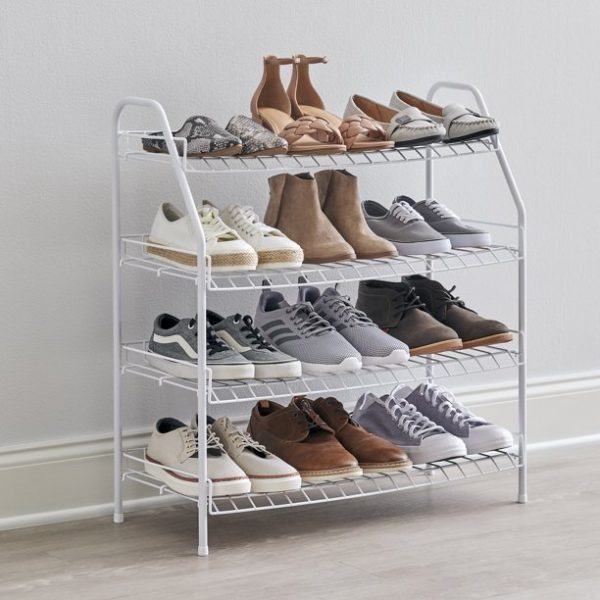
Where is `shoes on second shelf`? The image size is (600, 600). shoes on second shelf is located at coordinates (444, 219), (412, 230), (363, 240), (316, 241), (268, 252), (230, 250).